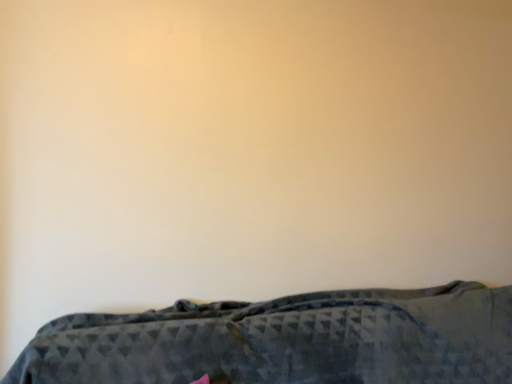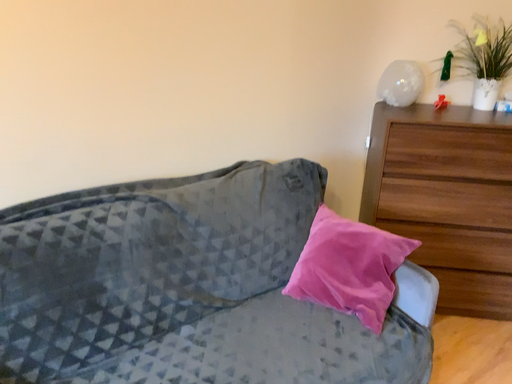
Question: How did the camera likely rotate when shooting the video?

Choices:
 (A) rotated left
 (B) rotated right

Answer: (B)